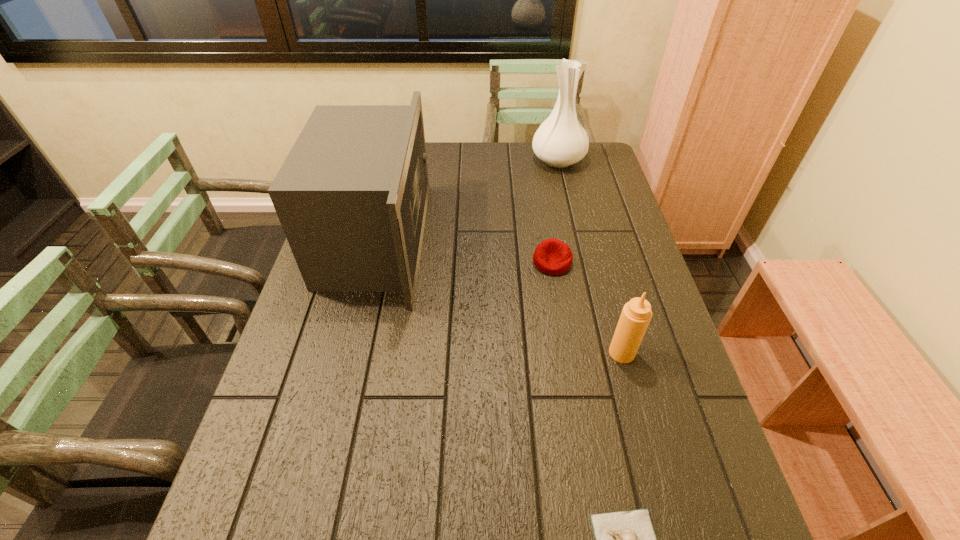
Locate an element on the screen. the farthest object is located at coordinates (560, 141).

This screenshot has width=960, height=540. Find the location of `microwave oven`. microwave oven is located at coordinates (351, 196).

Image resolution: width=960 pixels, height=540 pixels. Identify the location of the third tallest object. (635, 317).

The image size is (960, 540). Find the location of `the second nearest object`. the second nearest object is located at coordinates (635, 317).

Locate an element on the screen. The image size is (960, 540). the second shortest object is located at coordinates (552, 256).

Where is `free location located on the left of the vase`? free location located on the left of the vase is located at coordinates (515, 160).

The height and width of the screenshot is (540, 960). Find the location of `free space located on the front-facing side of the microwave oven`. free space located on the front-facing side of the microwave oven is located at coordinates click(459, 240).

Find the location of `free space located on the back of the third tallest object`. free space located on the back of the third tallest object is located at coordinates (604, 285).

Locate an element on the screen. vacant position located 0.100m on the seat area of the second shortest object is located at coordinates (559, 303).

What are the coordinates of `object that is at the far edge` in the screenshot? It's located at (560, 141).